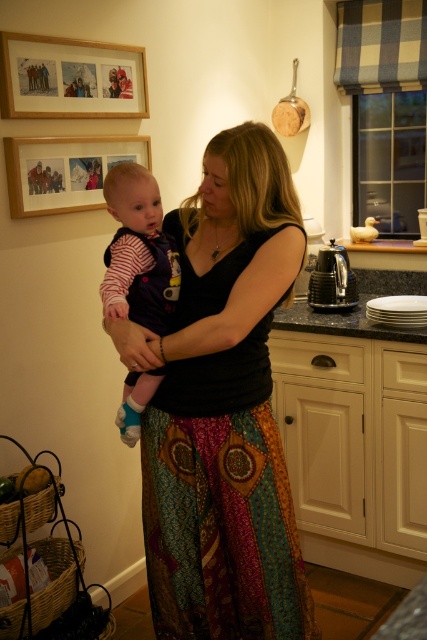
In the kitchen scene, you notice the striped cotton onesie at center and the wooden framed picture at upper left. Which object is narrower?

The striped cotton onesie at center is narrower than the wooden framed picture at upper left.

Consider the image. In the kitchen scene, you notice the striped cotton onesie at center and the wooden framed picture at upper left. Which object is positioned lower in the image?

The striped cotton onesie at center is located below the wooden framed picture at upper left, so it is positioned lower in the image.

You are a photographer trying to capture the baby in the striped cotton onesie at center. You notice a point at coordinates (137, 252) in the image. Based on the description, where is this point located?

The point at coordinates (137, 252) is located on the striped cotton onesie at center.